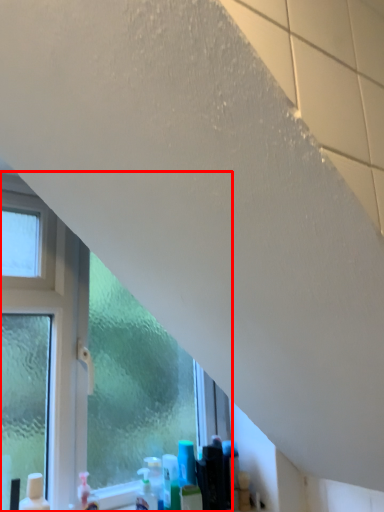
Question: From the image's perspective, where is window (annotated by the red box) located in relation to cleaning product in the image?

Choices:
 (A) below
 (B) above

Answer: (B)